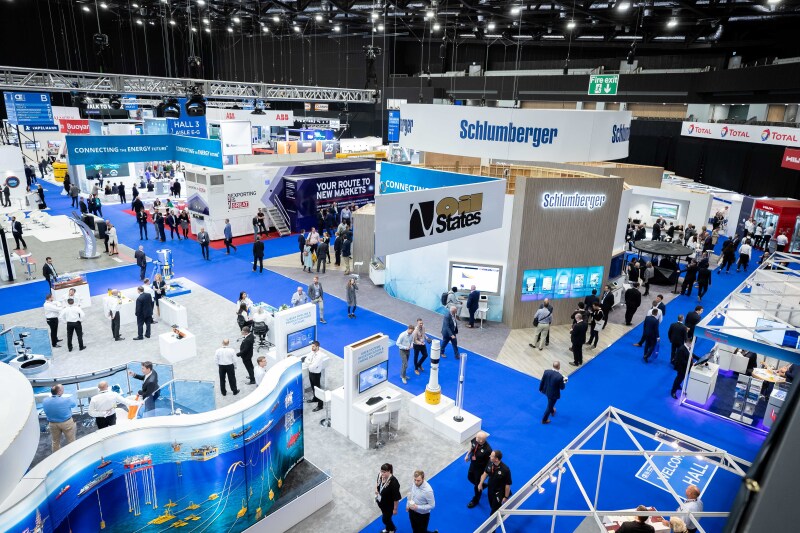
Find the location of a particular element. Image resolution: width=800 pixels, height=533 pixels. back wall is located at coordinates (114, 58).